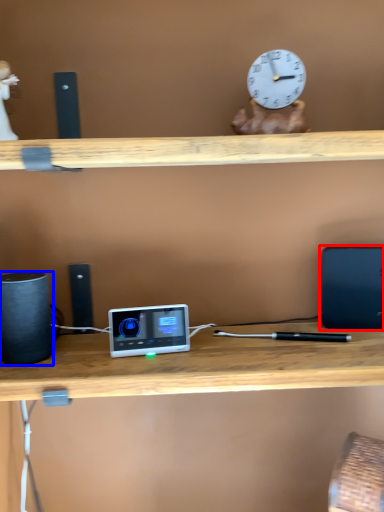
Question: Which of the following is the closest to the observer, laptop (highlighted by a red box) or speaker (highlighted by a blue box)?

Choices:
 (A) laptop
 (B) speaker

Answer: (B)